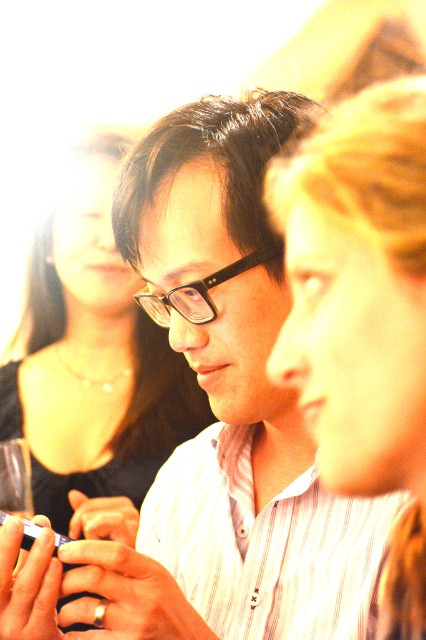
Does point (85, 237) lie in front of point (146, 308)?

No, (85, 237) is behind (146, 308).

Is black glossy hair at upper left further to the viewer compared to black plastic glasses at center?

Yes, black glossy hair at upper left is further from the viewer.

Is point (63, 301) behind point (192, 307)?

Yes, it is behind point (192, 307).

Where is `black glossy hair at upper left`? This screenshot has height=640, width=426. black glossy hair at upper left is located at coordinates (94, 364).